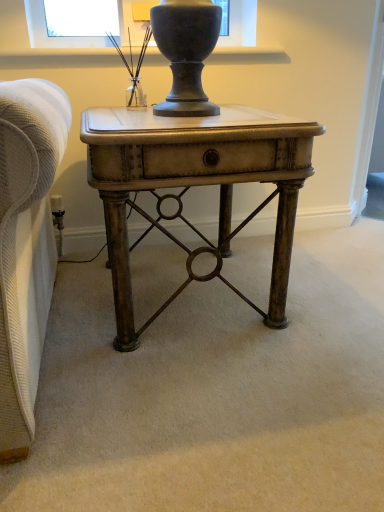
The height and width of the screenshot is (512, 384). What do you see at coordinates (194, 185) in the screenshot? I see `antique brass desk at center` at bounding box center [194, 185].

In order to click on antique brass desk at center in this screenshot , I will do tap(194, 185).

The image size is (384, 512). What are the coordinates of `matte black table lamp at upper center` in the screenshot? It's located at (138, 59).

What do you see at coordinates (138, 59) in the screenshot? The image size is (384, 512). I see `matte black table lamp at upper center` at bounding box center [138, 59].

Where is `antique brass desk at center`? antique brass desk at center is located at coordinates (194, 185).

Is antique brass desk at center at the right side of matte black table lamp at upper center?

Yes, antique brass desk at center is to the right of matte black table lamp at upper center.

Considering the relative positions of antique brass desk at center and matte black table lamp at upper center in the image provided, is antique brass desk at center in front of matte black table lamp at upper center?

Yes, antique brass desk at center is in front of matte black table lamp at upper center.

Does point (177, 169) appear closer or farther from the camera than point (138, 69)?

Point (177, 169).

From the image's perspective, is antique brass desk at center under matte black table lamp at upper center?

Yes.

From a real-world perspective, relative to matte black table lamp at upper center, is antique brass desk at center vertically above or below?

Clearly, from a real-world perspective, antique brass desk at center is below matte black table lamp at upper center.

Which object is wider, antique brass desk at center or matte black table lamp at upper center?

antique brass desk at center is wider.

Considering the sizes of objects antique brass desk at center and matte black table lamp at upper center in the image provided, who is taller, antique brass desk at center or matte black table lamp at upper center?

antique brass desk at center is taller.

Does antique brass desk at center have a larger size compared to matte black table lamp at upper center?

Yes, antique brass desk at center is bigger than matte black table lamp at upper center.

Is matte black table lamp at upper center inside antique brass desk at center?

No, matte black table lamp at upper center is located outside of antique brass desk at center.

Is antique brass desk at center beside matte black table lamp at upper center?

No, antique brass desk at center is not next to matte black table lamp at upper center.

Is matte black table lamp at upper center at the back of antique brass desk at center?

That's not correct — antique brass desk at center is not looking away from matte black table lamp at upper center.

How many degrees apart are the facing directions of antique brass desk at center and matte black table lamp at upper center?

There is a 0.00375-degree angle between the facing directions of antique brass desk at center and matte black table lamp at upper center.

At what (x,y) coordinates should I click in order to perform the action: click on desk below the matte black table lamp at upper center (from the image's perspective). Please return your answer as a coordinate pair (x, y). Looking at the image, I should click on (194, 185).

Is matte black table lamp at upper center to the left of antique brass desk at center from the viewer's perspective?

Yes, matte black table lamp at upper center is to the left of antique brass desk at center.

Is matte black table lamp at upper center further to the viewer compared to antique brass desk at center?

Yes, matte black table lamp at upper center is further from the viewer.

Which point is more forward, (x=128, y=105) or (x=289, y=148)?

The point (x=289, y=148) is more forward.

From the image's perspective, which one is positioned higher, matte black table lamp at upper center or antique brass desk at center?

From the image's view, matte black table lamp at upper center is above.

From a real-world perspective, relative to antique brass desk at center, is matte black table lamp at upper center vertically above or below?

In terms of real-world spatial position, matte black table lamp at upper center is above antique brass desk at center.

Which object is wider, matte black table lamp at upper center or antique brass desk at center?

antique brass desk at center is wider.

Which of these two, matte black table lamp at upper center or antique brass desk at center, stands taller?

Standing taller between the two is antique brass desk at center.

Who is bigger, matte black table lamp at upper center or antique brass desk at center?

antique brass desk at center is bigger.

Is matte black table lamp at upper center inside the boundaries of antique brass desk at center, or outside?

matte black table lamp at upper center is not enclosed by antique brass desk at center.

Is matte black table lamp at upper center next to antique brass desk at center and touching it?

No, matte black table lamp at upper center is not touching antique brass desk at center.

Is matte black table lamp at upper center positioned with its back to antique brass desk at center?

No, matte black table lamp at upper center is not facing the opposite direction of antique brass desk at center.

Locate an element on the screen. table lamp located behind the antique brass desk at center is located at coordinates (138, 59).

In order to click on table lamp on the left of antique brass desk at center in this screenshot , I will do `click(138, 59)`.

In the image, there is a matte black table lamp at upper center. At what (x,y) coordinates should I click in order to perform the action: click on desk below it (from the image's perspective). Please return your answer as a coordinate pair (x, y). The image size is (384, 512). Looking at the image, I should click on (194, 185).